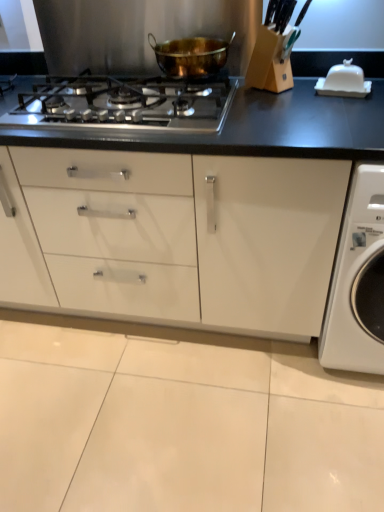
Question: From a real-world perspective, does gold metallic pot at center stand above white glossy washing machine at right?

Choices:
 (A) yes
 (B) no

Answer: (A)

Question: Is gold metallic pot at center to the right of white glossy washing machine at right from the viewer's perspective?

Choices:
 (A) yes
 (B) no

Answer: (B)

Question: Is white glossy washing machine at right at the back of gold metallic pot at center?

Choices:
 (A) yes
 (B) no

Answer: (B)

Question: Is gold metallic pot at center closer to the viewer compared to white glossy washing machine at right?

Choices:
 (A) no
 (B) yes

Answer: (A)

Question: Considering the relative sizes of gold metallic pot at center and white glossy washing machine at right in the image provided, is gold metallic pot at center smaller than white glossy washing machine at right?

Choices:
 (A) no
 (B) yes

Answer: (B)

Question: Is gold metallic pot at center taller than white glossy washing machine at right?

Choices:
 (A) no
 (B) yes

Answer: (A)

Question: Can you confirm if gold metallic pot at center is taller than satin silver gas stove at center?

Choices:
 (A) no
 (B) yes

Answer: (B)

Question: Considering the relative sizes of gold metallic pot at center and satin silver gas stove at center in the image provided, is gold metallic pot at center thinner than satin silver gas stove at center?

Choices:
 (A) no
 (B) yes

Answer: (B)

Question: Is gold metallic pot at center smaller than satin silver gas stove at center?

Choices:
 (A) no
 (B) yes

Answer: (B)

Question: Is gold metallic pot at center bigger than satin silver gas stove at center?

Choices:
 (A) no
 (B) yes

Answer: (A)

Question: Considering the relative positions of gold metallic pot at center and satin silver gas stove at center in the image provided, is gold metallic pot at center to the left of satin silver gas stove at center from the viewer's perspective?

Choices:
 (A) no
 (B) yes

Answer: (A)

Question: From a real-world perspective, is gold metallic pot at center physically below satin silver gas stove at center?

Choices:
 (A) no
 (B) yes

Answer: (A)

Question: From the image's perspective, is satin silver gas stove at center under white glossy washing machine at right?

Choices:
 (A) no
 (B) yes

Answer: (A)